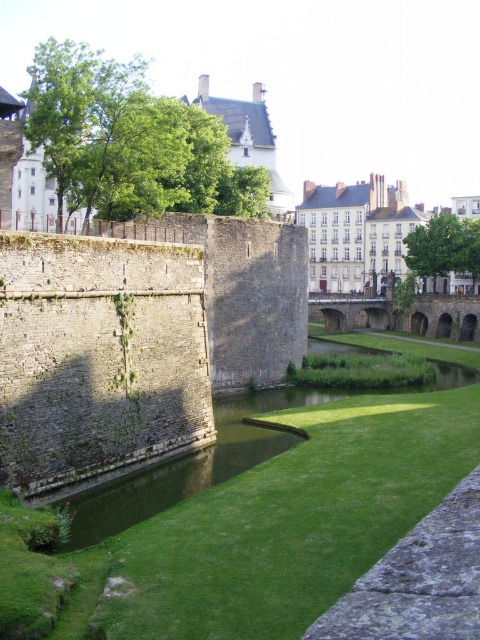
You are a gardener who wants to plant flowers on the green grass at center. However, you need to cross the stone arch bridge at center to reach the grass. Is the bridge directly above the grass where you want to plant the flowers?

Yes, the green grass at center is below the stone arch bridge at center, so the bridge is directly above the grass where you want to plant the flowers.

You are a landscape architect designing a new garden. You have to place a small decorative pond in the scene. Given the green grass at center and the stone arch bridge at center, which area would be more suitable for the pond based on their sizes?

The green grass at center is larger in size than the stone arch bridge at center, so the green grass at center would be more suitable for placing the pond due to its larger area.